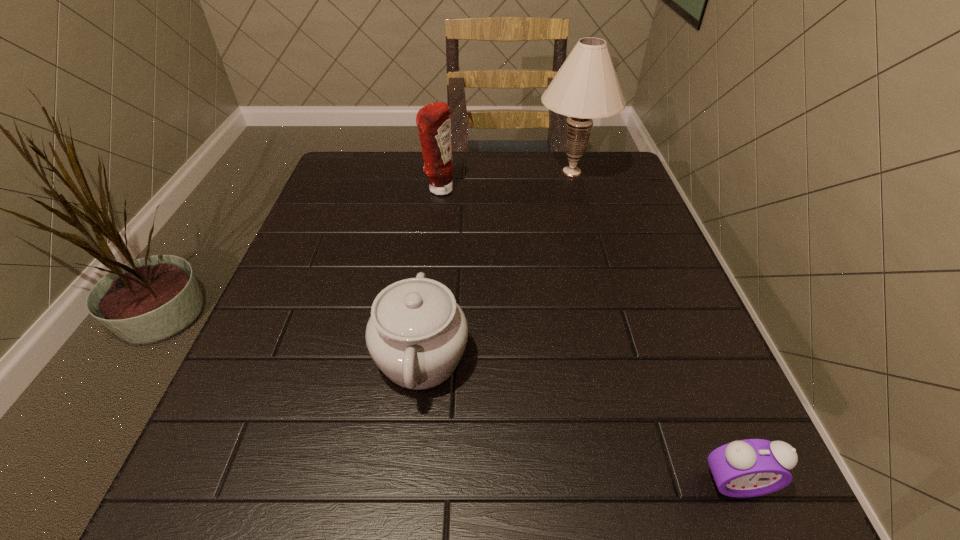
The width and height of the screenshot is (960, 540). In order to click on free spot at the far left corner of the desktop in this screenshot , I will do `click(348, 199)`.

This screenshot has height=540, width=960. In order to click on free space between the tallest object and the shortest object in this screenshot , I will do `click(654, 327)`.

Find the location of a particular element. This screenshot has height=540, width=960. vacant space in between the tallest object and the second shortest object is located at coordinates (496, 265).

Identify the location of vacant space that is in between the tallest object and the third farthest object. (496, 265).

Locate an element on the screen. empty space between the condiment and the nearest object is located at coordinates (588, 336).

The height and width of the screenshot is (540, 960). In order to click on empty space that is in between the alarm clock and the chinaware in this screenshot , I will do `click(578, 420)`.

The height and width of the screenshot is (540, 960). In order to click on free space between the nearest object and the chinaware in this screenshot , I will do `click(578, 420)`.

At what (x,y) coordinates should I click in order to perform the action: click on vacant region between the third shortest object and the alarm clock. Please return your answer as a coordinate pair (x, y). Looking at the image, I should click on (588, 336).

The width and height of the screenshot is (960, 540). In order to click on free space between the condiment and the lampshade in this screenshot , I will do `click(505, 180)`.

This screenshot has height=540, width=960. I want to click on vacant region between the third shortest object and the lampshade, so click(505, 180).